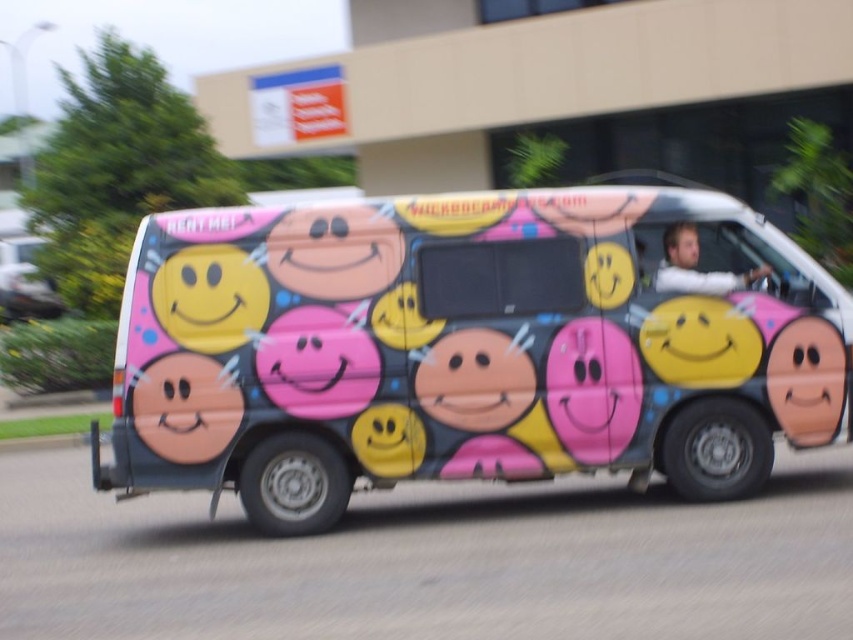
You are a photographer trying to capture the van from the best angle. You notice two points on the van labeled as point (376, 408) and point (688, 234). Which point is closer to you?

Point (376, 408) is closer to the viewer than point (688, 234).

What are the coordinates of the matte pink smiley face at center on the van?

The matte pink smiley face at center is located at coordinates point (x=184, y=406).